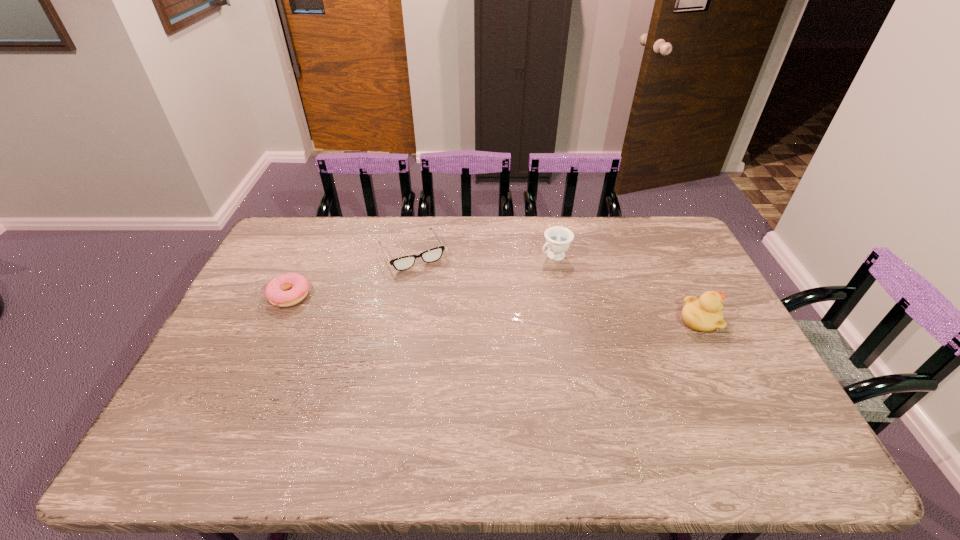
You are a GUI agent. You are given a task and a screenshot of the screen. Output one action in this format:
    pyautogui.click(x=<x>, y=<y>)
    Task: Click on the unoccupied area between the third object from left to right and the third object from right to left
    The width and height of the screenshot is (960, 540).
    Given the screenshot: What is the action you would take?
    pyautogui.click(x=484, y=254)

At what (x,y) coordinates should I click in order to perform the action: click on free space between the teacup and the duckling. Please return your answer as a coordinate pair (x, y). Looking at the image, I should click on (628, 288).

Where is `free space between the leftmost object and the spectacles`? free space between the leftmost object and the spectacles is located at coordinates (351, 274).

At what (x,y) coordinates should I click in order to perform the action: click on empty space between the third object from left to right and the doughnut. Please return your answer as a coordinate pair (x, y). The image size is (960, 540). Looking at the image, I should click on (422, 275).

The width and height of the screenshot is (960, 540). I want to click on free space between the leftmost object and the second object from left to right, so click(351, 274).

Where is `empty space between the duckling and the second object from left to right`? empty space between the duckling and the second object from left to right is located at coordinates (556, 286).

This screenshot has height=540, width=960. In order to click on empty location between the rightmost object and the second object from right to left in this screenshot , I will do `click(628, 288)`.

Locate an element on the screen. free space between the spectacles and the teacup is located at coordinates (484, 254).

Where is `vacant space in between the second object from left to right and the rightmost object`? Image resolution: width=960 pixels, height=540 pixels. vacant space in between the second object from left to right and the rightmost object is located at coordinates (556, 286).

Image resolution: width=960 pixels, height=540 pixels. In order to click on unoccupied area between the third object from right to left and the doughnut in this screenshot , I will do `click(351, 274)`.